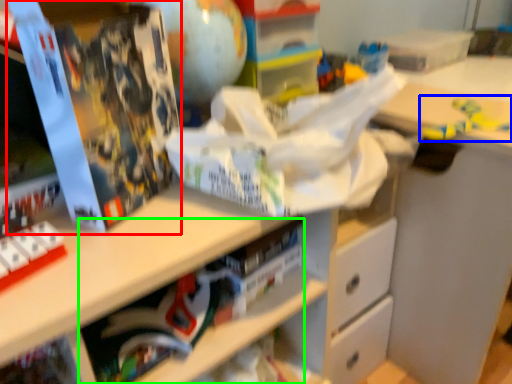
Question: Which object is the closest to the paperback book (highlighted by a red box)? Choose among these: toy (highlighted by a blue box) or book (highlighted by a green box).

Choices:
 (A) toy
 (B) book

Answer: (B)